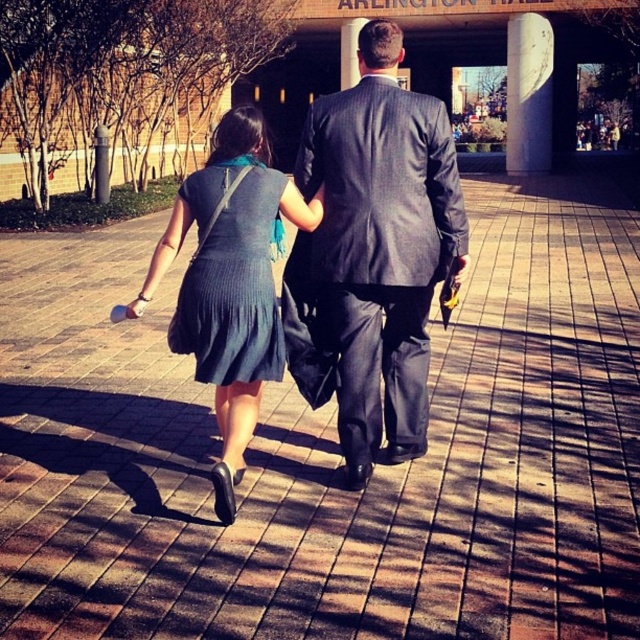
You are standing at the back of the image and want to take a photo of the knit fabric dress at center without including the white marble pillar at upper right in the frame. Is it possible to do so by moving your camera position slightly?

The knit fabric dress at center is positioned under the white marble pillar at upper right, so moving the camera position slightly might still include the pillar in the frame. To avoid it, you might need to adjust your angle or move further away to exclude the pillar.

Based on the scene description, can you determine which object, the matte black dress at center or the white marble pillar at upper right, is bigger in size?

The matte black dress at center has a larger size compared to the white marble pillar at upper right, so the matte black dress at center is bigger.